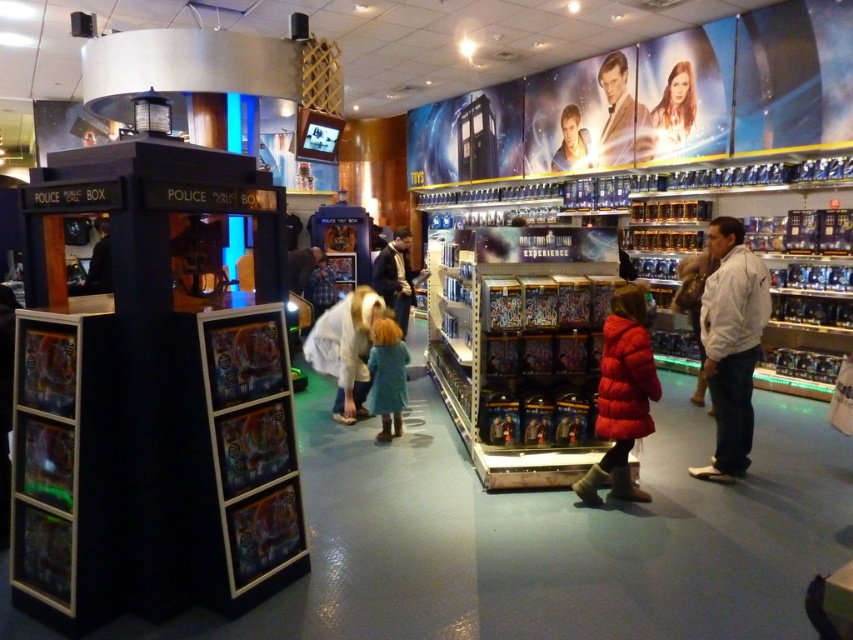
What do you see at coordinates (622, 396) in the screenshot? I see `red puffy coat at center` at bounding box center [622, 396].

Locate an element on the screen. red puffy coat at center is located at coordinates (622, 396).

Measure the distance between red puffy coat at center and camera.

They are 3.54 meters apart.

This screenshot has width=853, height=640. I want to click on red puffy coat at center, so click(622, 396).

Who is shorter, white fleece jacket at right or white cotton shirt at right?

Result: Standing shorter between the two is white cotton shirt at right.

Looking at this image, is white fleece jacket at right taller than white cotton shirt at right?

Indeed, white fleece jacket at right has a greater height compared to white cotton shirt at right.

Measure the distance between point (759, 260) and camera.

Point (759, 260) is 13.27 feet away from camera.

You are a GUI agent. You are given a task and a screenshot of the screen. Output one action in this format:
    pyautogui.click(x=<x>, y=<y>)
    Task: Click on the white fleece jacket at right
    
    Given the screenshot: What is the action you would take?
    pyautogui.click(x=730, y=344)

Measure the distance between point (747, 292) and camera.

They are 3.93 meters apart.

The width and height of the screenshot is (853, 640). In order to click on white fleece jacket at right in this screenshot , I will do `click(730, 344)`.

Locate an element on the screen. This screenshot has width=853, height=640. white fleece jacket at right is located at coordinates (730, 344).